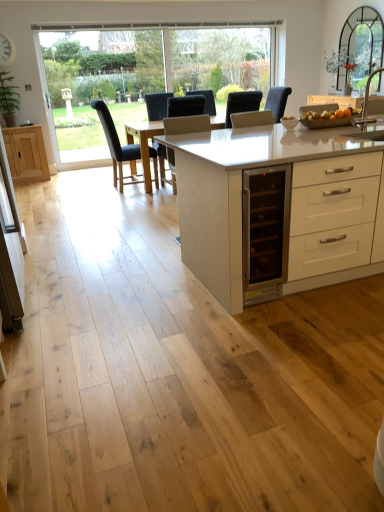
Question: Considering the relative sizes of black leather chair at center, which is the 1th chair in left-to-right order, and white glossy table at center in the image provided, is black leather chair at center, which is the 1th chair in left-to-right order, smaller than white glossy table at center?

Choices:
 (A) yes
 (B) no

Answer: (A)

Question: Are black leather chair at center, placed as the second chair when sorted from right to left, and white glossy table at center beside each other?

Choices:
 (A) no
 (B) yes

Answer: (A)

Question: Does black leather chair at center, placed as the second chair when sorted from right to left, come in front of white glossy table at center?

Choices:
 (A) no
 (B) yes

Answer: (A)

Question: From the image's perspective, is black leather chair at center, placed as the second chair when sorted from right to left, on white glossy table at center?

Choices:
 (A) no
 (B) yes

Answer: (B)

Question: Can we say black leather chair at center, placed as the second chair when sorted from right to left, lies outside white glossy table at center?

Choices:
 (A) no
 (B) yes

Answer: (B)

Question: Is black leather chair at center, which is the 1th chair in left-to-right order, in front of or behind white glossy table at center in the image?

Choices:
 (A) behind
 (B) front

Answer: (A)

Question: In terms of size, does black leather chair at center, placed as the second chair when sorted from right to left, appear bigger or smaller than white glossy table at center?

Choices:
 (A) big
 (B) small

Answer: (B)

Question: In the image, is black leather chair at center, which is the 1th chair in left-to-right order, on the left side or the right side of white glossy table at center?

Choices:
 (A) right
 (B) left

Answer: (B)

Question: From a real-world perspective, is black leather chair at center, placed as the second chair when sorted from right to left, physically located above or below white glossy table at center?

Choices:
 (A) above
 (B) below

Answer: (A)

Question: Is dark gray fabric chair at center, which is the 2th chair in left-to-right order, wider or thinner than silver metallic sink at right?

Choices:
 (A) thin
 (B) wide

Answer: (B)

Question: Is dark gray fabric chair at center, which is the first chair in right-to-left order, spatially inside silver metallic sink at right, or outside of it?

Choices:
 (A) outside
 (B) inside

Answer: (A)

Question: From the image's perspective, is dark gray fabric chair at center, which is the 2th chair in left-to-right order, above or below silver metallic sink at right?

Choices:
 (A) above
 (B) below

Answer: (A)

Question: From a real-world perspective, is dark gray fabric chair at center, which is the 2th chair in left-to-right order, physically located above or below silver metallic sink at right?

Choices:
 (A) below
 (B) above

Answer: (A)

Question: Considering the positions of point (246, 88) and point (314, 141), is point (246, 88) closer or farther from the camera than point (314, 141)?

Choices:
 (A) farther
 (B) closer

Answer: (A)

Question: Would you say clear glass window at upper left is inside or outside white glossy table at center?

Choices:
 (A) outside
 (B) inside

Answer: (A)